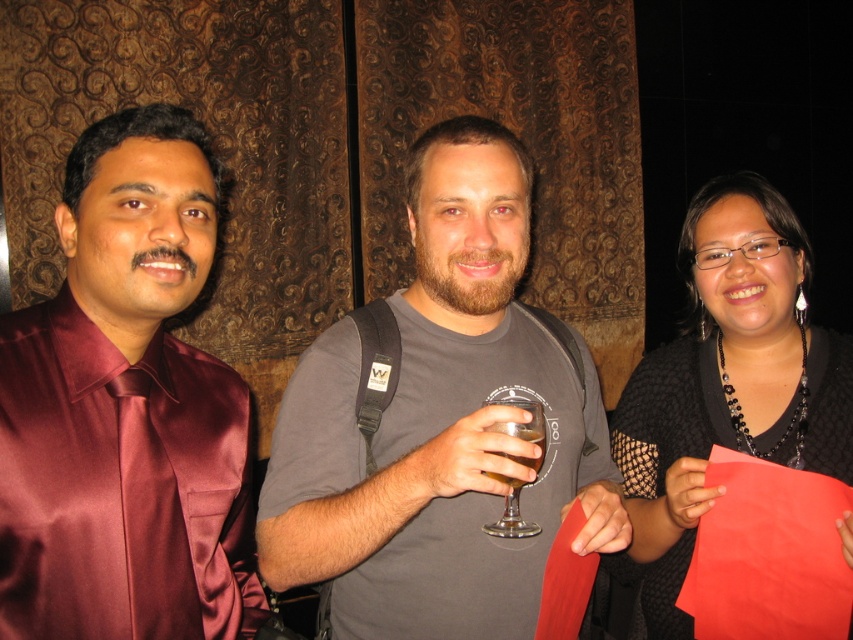
This screenshot has width=853, height=640. Identify the location of maroon satin shirt at left. tap(125, 410).

Who is more distant from viewer, (128, 173) or (531, 404)?

The point (531, 404) is behind.

Does point (86, 336) lie in front of point (543, 452)?

Yes, point (86, 336) is closer to viewer.

At what (x,y) coordinates should I click in order to perform the action: click on maroon satin shirt at left. Please return your answer as a coordinate pair (x, y). The height and width of the screenshot is (640, 853). Looking at the image, I should click on (125, 410).

Which is below, black mesh dress at right or translucent glass at center?

translucent glass at center

Can you confirm if black mesh dress at right is taller than translucent glass at center?

Correct, black mesh dress at right is much taller as translucent glass at center.

Is point (720, 435) less distant than point (503, 477)?

That is False.

Where is `black mesh dress at right`? black mesh dress at right is located at coordinates (728, 381).

Between point (509, 524) and point (505, 481), which one is positioned in front?

Point (505, 481)

Which is behind, point (519, 536) or point (517, 486)?

Positioned behind is point (519, 536).

This screenshot has height=640, width=853. Find the location of `clear glass wine glass at center`. clear glass wine glass at center is located at coordinates (523, 428).